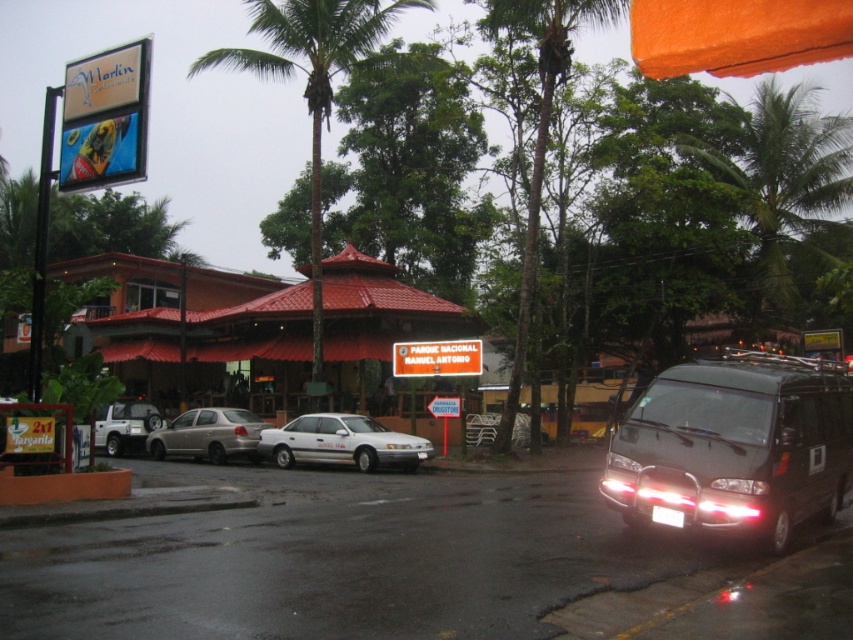
Question: Among these objects, which one is farthest from the camera?

Choices:
 (A) orange fabric canopy at upper right
 (B) white matte sedan at center

Answer: (B)

Question: Which object appears farthest from the camera in this image?

Choices:
 (A) orange fabric canopy at upper right
 (B) silver metallic suv at center-left
 (C) green leafy palm tree at upper right

Answer: (B)

Question: Can you confirm if orange fabric canopy at upper right is positioned above white matte sedan at center?

Choices:
 (A) no
 (B) yes

Answer: (B)

Question: Which of these objects is positioned closest to the silver metallic suv at center-left?

Choices:
 (A) satin silver sedan at center
 (B) green leafy palm tree at upper right

Answer: (A)

Question: Is green leafy palm tree at upper right to the left of white plastic license plate at rear from the viewer's perspective?

Choices:
 (A) no
 (B) yes

Answer: (A)

Question: Can you confirm if orange fabric canopy at upper right is positioned to the right of white plastic license plate at rear?

Choices:
 (A) yes
 (B) no

Answer: (B)